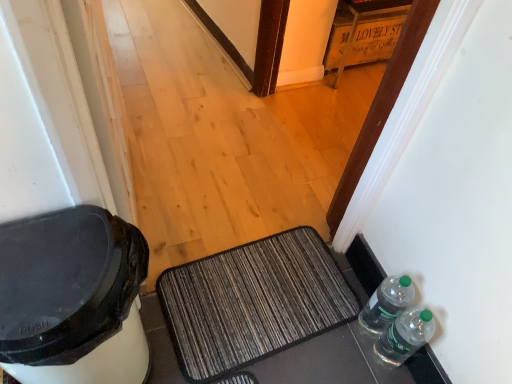
The height and width of the screenshot is (384, 512). Describe the element at coordinates (253, 302) in the screenshot. I see `textured gray doormat at center` at that location.

What is the approximate width of textured gray doormat at center?

The width of textured gray doormat at center is 16.29 inches.

Describe the element at coordinates (362, 33) in the screenshot. I see `wooden crate at upper center` at that location.

Locate an element on the screen. textured gray doormat at center is located at coordinates (253, 302).

From the picture: Can you tell me how much clear plastic bottles at lower right, which is the first bottle in front-to-back order, and wooden crate at upper center differ in facing direction?

178 degrees separate the facing orientations of clear plastic bottles at lower right, which is the first bottle in front-to-back order, and wooden crate at upper center.

From a real-world perspective, count 2nd bottles upward from the wooden crate at upper center and point to it. Please provide its 2D coordinates.

[(405, 336)]

Between clear plastic bottles at lower right, which is the first bottle in front-to-back order, and wooden crate at upper center, which one has larger size?

With larger size is wooden crate at upper center.

In the image, is clear plastic bottles at lower right, which ranks as the first bottle in back-to-front order, positioned in front of or behind clear plastic bottles at lower right, which is the first bottle in front-to-back order?

Visually, clear plastic bottles at lower right, which ranks as the first bottle in back-to-front order, is located behind clear plastic bottles at lower right, which is the first bottle in front-to-back order.

Based on their positions, is clear plastic bottles at lower right, which ranks as the first bottle in back-to-front order, located to the left or right of clear plastic bottles at lower right, the second bottle viewed from the back?

Clearly, clear plastic bottles at lower right, which ranks as the first bottle in back-to-front order, is on the left of clear plastic bottles at lower right, the second bottle viewed from the back, in the image.

Could you measure the distance between clear plastic bottles at lower right, which ranks as the first bottle in back-to-front order, and clear plastic bottles at lower right, which is the first bottle in front-to-back order?

They are 2.33 inches apart.

Locate an element on the screen. This screenshot has height=384, width=512. bottle above the clear plastic bottles at lower right, which ranks as the first bottle in back-to-front order (from a real-world perspective) is located at coordinates pos(405,336).

Does wooden crate at upper center come in front of textured gray doormat at center?

No, wooden crate at upper center is further to the viewer.

Is wooden crate at upper center to the left or to the right of textured gray doormat at center in the image?

In the image, wooden crate at upper center appears on the right side of textured gray doormat at center.

Is wooden crate at upper center positioned beyond the bounds of textured gray doormat at center?

wooden crate at upper center is positioned outside textured gray doormat at center.

Considering the positions of points (362, 53) and (284, 276), is point (362, 53) farther from camera compared to point (284, 276)?

That is True.

Is clear plastic bottles at lower right, which is the first bottle in front-to-back order, facing away from clear plastic bottles at lower right, which ranks as the first bottle in back-to-front order?

No, clear plastic bottles at lower right, which is the first bottle in front-to-back order, is not facing away from clear plastic bottles at lower right, which ranks as the first bottle in back-to-front order.

Is clear plastic bottles at lower right, which is the first bottle in front-to-back order, touching clear plastic bottles at lower right, which ranks as the first bottle in back-to-front order?

Absolutely, clear plastic bottles at lower right, which is the first bottle in front-to-back order, is next to and touching clear plastic bottles at lower right, which ranks as the first bottle in back-to-front order.

From a real-world perspective, which is physically below, clear plastic bottles at lower right, which is the first bottle in front-to-back order, or clear plastic bottles at lower right, which ranks as the first bottle in back-to-front order?

clear plastic bottles at lower right, which ranks as the first bottle in back-to-front order, from a real-world perspective.

Does clear plastic bottles at lower right, which is the first bottle in front-to-back order, appear on the left side of clear plastic bottles at lower right, which appears as the 2th bottle when viewed from the front?

Incorrect, clear plastic bottles at lower right, which is the first bottle in front-to-back order, is not on the left side of clear plastic bottles at lower right, which appears as the 2th bottle when viewed from the front.

Does point (260, 350) come in front of point (349, 46)?

Yes, it is.

In the image, is textured gray doormat at center positioned in front of or behind wooden crate at upper center?

textured gray doormat at center is positioned closer to the viewer than wooden crate at upper center.

Considering the sizes of objects textured gray doormat at center and wooden crate at upper center in the image provided, who is wider, textured gray doormat at center or wooden crate at upper center?

wooden crate at upper center is wider.

Looking at this image, is textured gray doormat at center aimed at wooden crate at upper center?

No, textured gray doormat at center is not aimed at wooden crate at upper center.

Is clear plastic bottles at lower right, which appears as the 2th bottle when viewed from the front, far from wooden crate at upper center?

Yes, clear plastic bottles at lower right, which appears as the 2th bottle when viewed from the front, and wooden crate at upper center are located far from each other.

Would you say clear plastic bottles at lower right, which appears as the 2th bottle when viewed from the front, contains wooden crate at upper center?

No, clear plastic bottles at lower right, which appears as the 2th bottle when viewed from the front, does not contain wooden crate at upper center.

In terms of size, does clear plastic bottles at lower right, which appears as the 2th bottle when viewed from the front, appear bigger or smaller than wooden crate at upper center?

Clearly, clear plastic bottles at lower right, which appears as the 2th bottle when viewed from the front, is smaller in size than wooden crate at upper center.

Does clear plastic bottles at lower right, which ranks as the first bottle in back-to-front order, have a greater width compared to wooden crate at upper center?

No.

Which bottle is the 2nd one when counting from the right side of the textured gray doormat at center? Please provide its 2D coordinates.

[(405, 336)]

What's the angular difference between clear plastic bottles at lower right, the second bottle viewed from the back, and textured gray doormat at center's facing directions?

clear plastic bottles at lower right, the second bottle viewed from the back, and textured gray doormat at center are facing 92.1 degrees away from each other.

In the scene shown: Considering the relative sizes of clear plastic bottles at lower right, which is the first bottle in front-to-back order, and textured gray doormat at center in the image provided, is clear plastic bottles at lower right, which is the first bottle in front-to-back order, thinner than textured gray doormat at center?

Yes, clear plastic bottles at lower right, which is the first bottle in front-to-back order, is thinner than textured gray doormat at center.

Locate an element on the screen. The height and width of the screenshot is (384, 512). cabinetry behind the clear plastic bottles at lower right, the second bottle viewed from the back is located at coordinates (362, 33).

Where is `bottle in front of the clear plastic bottles at lower right, which appears as the 2th bottle when viewed from the front`? bottle in front of the clear plastic bottles at lower right, which appears as the 2th bottle when viewed from the front is located at coordinates (x=405, y=336).

Estimate the real-world distances between objects in this image. Which object is further from wooden crate at upper center, clear plastic bottles at lower right, the second bottle viewed from the back, or textured gray doormat at center?

clear plastic bottles at lower right, the second bottle viewed from the back, is positioned further to the anchor wooden crate at upper center.

From the image, which object appears to be farther from wooden crate at upper center, clear plastic bottles at lower right, which appears as the 2th bottle when viewed from the front, or clear plastic bottles at lower right, which is the first bottle in front-to-back order?

clear plastic bottles at lower right, which is the first bottle in front-to-back order, lies further to wooden crate at upper center than the other object.

Considering their positions, is clear plastic bottles at lower right, which ranks as the first bottle in back-to-front order, positioned closer to clear plastic bottles at lower right, the second bottle viewed from the back, than wooden crate at upper center?

clear plastic bottles at lower right, which ranks as the first bottle in back-to-front order, lies closer to clear plastic bottles at lower right, the second bottle viewed from the back, than the other object.

Considering their positions, is textured gray doormat at center positioned further to clear plastic bottles at lower right, which appears as the 2th bottle when viewed from the front, than clear plastic bottles at lower right, the second bottle viewed from the back?

textured gray doormat at center.

Which object lies further to the anchor point clear plastic bottles at lower right, which is the first bottle in front-to-back order, wooden crate at upper center or textured gray doormat at center?

wooden crate at upper center is positioned further to the anchor clear plastic bottles at lower right, which is the first bottle in front-to-back order.

Which object lies further to the anchor point textured gray doormat at center, clear plastic bottles at lower right, which appears as the 2th bottle when viewed from the front, or wooden crate at upper center?

The object further to textured gray doormat at center is wooden crate at upper center.

Based on their spatial positions, is clear plastic bottles at lower right, the second bottle viewed from the back, or wooden crate at upper center closer to textured gray doormat at center?

clear plastic bottles at lower right, the second bottle viewed from the back.

Looking at the image, which one is located closer to clear plastic bottles at lower right, which is the first bottle in front-to-back order, textured gray doormat at center or clear plastic bottles at lower right, which appears as the 2th bottle when viewed from the front?

clear plastic bottles at lower right, which appears as the 2th bottle when viewed from the front, lies closer to clear plastic bottles at lower right, which is the first bottle in front-to-back order, than the other object.

The image size is (512, 384). I want to click on bottle between wooden crate at upper center and clear plastic bottles at lower right, the second bottle viewed from the back, in the vertical direction, so click(x=387, y=303).

You are a GUI agent. You are given a task and a screenshot of the screen. Output one action in this format:
    pyautogui.click(x=<x>, y=<y>)
    Task: Click on the doormat between wooden crate at upper center and clear plastic bottles at lower right, the second bottle viewed from the back, in the vertical direction
    
    Given the screenshot: What is the action you would take?
    pyautogui.click(x=253, y=302)

This screenshot has width=512, height=384. Identify the location of bottle between wooden crate at upper center and textured gray doormat at center in the up-down direction. (387, 303).

Image resolution: width=512 pixels, height=384 pixels. Find the location of `bottle between textured gray doormat at center and clear plastic bottles at lower right, the second bottle viewed from the back, in the horizontal direction`. bottle between textured gray doormat at center and clear plastic bottles at lower right, the second bottle viewed from the back, in the horizontal direction is located at coordinates (387, 303).